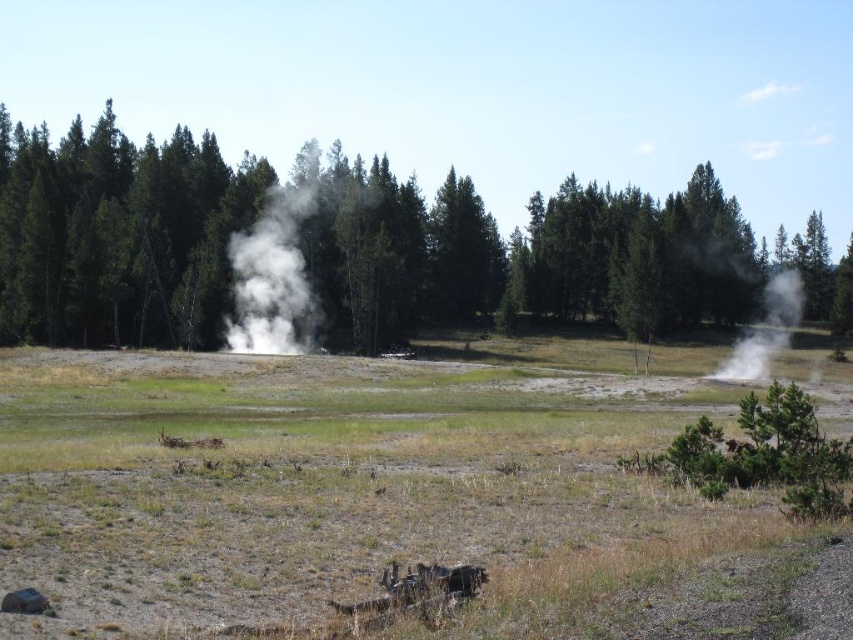
You are a hiker trying to locate the geothermal steam in this scene. You see the green grassy field at center and the white vapor at center. Which object is located to the left of the other?

The white vapor at center is located to the left of the green grassy field at center because the green grassy field at center is positioned on the right side of white vapor at center.

You are standing in the middle of the grassy field and want to walk towards the green matte tree at center and the white vapor at center. Which one will you reach first?

You will reach the green matte tree at center first because it is closer to you than the white vapor at center.